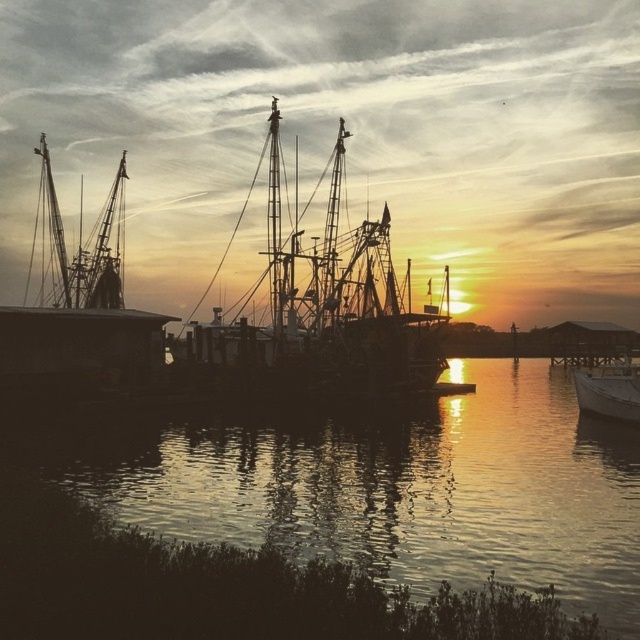
You are standing at the edge of the marina and want to walk from the glistening water at center to the white matte boat at lower right. Given that the distance between them is 28.98 meters, can you estimate how many steps it would take if each of your steps is about 0.75 meters long?

The distance between the glistening water at center and the white matte boat at lower right is 28.98 meters. If each step is 0.75 meters, dividing 28.98 by 0.75 gives approximately 38.64 steps. Since you can only take whole steps, it would take about 39 steps to cover the distance between them.

You are an observer standing on the dock. You notice two boats in the water. The silhouette wooden boat at center and the white matte boat at lower right. Which boat would appear wider from your vantage point?

The silhouette wooden boat at center appears wider than the white matte boat at lower right because its width is larger according to the description.

You are an observer standing on the dock. You see the silhouette wooden boat at center and the white matte boat at lower right. Which boat appears closer to the horizon based on their positions?

The silhouette wooden boat at center is above the white matte boat at lower right, meaning it is positioned higher in the scene and thus appears closer to the horizon.